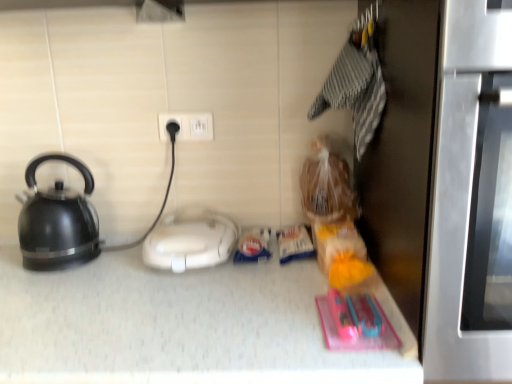
Question: Does matte black kettle at left come in front of white plastic electric outlet at center?

Choices:
 (A) yes
 (B) no

Answer: (A)

Question: Does matte black kettle at left appear on the right side of white plastic electric outlet at center?

Choices:
 (A) no
 (B) yes

Answer: (A)

Question: Is matte black kettle at left next to white plastic electric outlet at center?

Choices:
 (A) yes
 (B) no

Answer: (B)

Question: Does matte black kettle at left have a larger size compared to white plastic electric outlet at center?

Choices:
 (A) no
 (B) yes

Answer: (B)

Question: Can we say matte black kettle at left lies outside white plastic electric outlet at center?

Choices:
 (A) yes
 (B) no

Answer: (A)

Question: Is point (196, 137) closer or farther from the camera than point (220, 213)?

Choices:
 (A) farther
 (B) closer

Answer: (B)

Question: Is white plastic electric outlet at center in front of or behind white plastic appliance at center in the image?

Choices:
 (A) front
 (B) behind

Answer: (B)

Question: Is white plastic electric outlet at center spatially inside white plastic appliance at center, or outside of it?

Choices:
 (A) outside
 (B) inside

Answer: (A)

Question: From the image's perspective, relative to white plastic appliance at center, is white plastic electric outlet at center above or below?

Choices:
 (A) below
 (B) above

Answer: (B)

Question: From a real-world perspective, is stainless steel oven at right above or below white plastic electric outlet at center?

Choices:
 (A) above
 (B) below

Answer: (B)

Question: Do you think stainless steel oven at right is within white plastic electric outlet at center, or outside of it?

Choices:
 (A) outside
 (B) inside

Answer: (A)

Question: In the image, is stainless steel oven at right positioned in front of or behind white plastic electric outlet at center?

Choices:
 (A) front
 (B) behind

Answer: (A)

Question: In terms of width, does stainless steel oven at right look wider or thinner when compared to white plastic electric outlet at center?

Choices:
 (A) thin
 (B) wide

Answer: (B)

Question: Considering the positions of white plastic appliance at center and stainless steel oven at right in the image, is white plastic appliance at center taller or shorter than stainless steel oven at right?

Choices:
 (A) short
 (B) tall

Answer: (A)

Question: In the image, is white plastic appliance at center on the left side or the right side of stainless steel oven at right?

Choices:
 (A) right
 (B) left

Answer: (B)